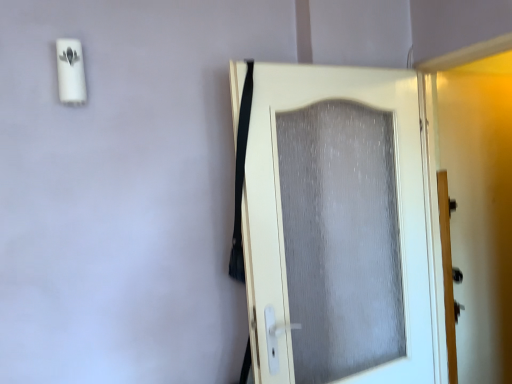
Question: Is matte gray screen door at right positioned far away from white textured door at center?

Choices:
 (A) yes
 (B) no

Answer: (B)

Question: From the image's perspective, is matte gray screen door at right on top of white textured door at center?

Choices:
 (A) no
 (B) yes

Answer: (B)

Question: Is matte gray screen door at right taller than white textured door at center?

Choices:
 (A) no
 (B) yes

Answer: (B)

Question: Is matte gray screen door at right thinner than white textured door at center?

Choices:
 (A) no
 (B) yes

Answer: (A)

Question: Considering the relative positions of matte gray screen door at right and white textured door at center in the image provided, is matte gray screen door at right in front of white textured door at center?

Choices:
 (A) yes
 (B) no

Answer: (B)

Question: From a real-world perspective, is matte gray screen door at right over white textured door at center?

Choices:
 (A) yes
 (B) no

Answer: (A)

Question: From the image's perspective, would you say white textured door at center is shown under matte gray screen door at right?

Choices:
 (A) yes
 (B) no

Answer: (A)

Question: Considering the relative positions of white textured door at center and matte gray screen door at right in the image provided, is white textured door at center to the left of matte gray screen door at right from the viewer's perspective?

Choices:
 (A) no
 (B) yes

Answer: (B)

Question: From a real-world perspective, is white textured door at center over matte gray screen door at right?

Choices:
 (A) yes
 (B) no

Answer: (B)

Question: From a real-world perspective, is white textured door at center below matte gray screen door at right?

Choices:
 (A) yes
 (B) no

Answer: (A)

Question: From the image's perspective, is white textured door at center on top of matte gray screen door at right?

Choices:
 (A) no
 (B) yes

Answer: (A)

Question: Can you confirm if white textured door at center is bigger than matte gray screen door at right?

Choices:
 (A) yes
 (B) no

Answer: (A)

Question: From a real-world perspective, is matte gray screen door at right above or below white textured door at center?

Choices:
 (A) below
 (B) above

Answer: (B)